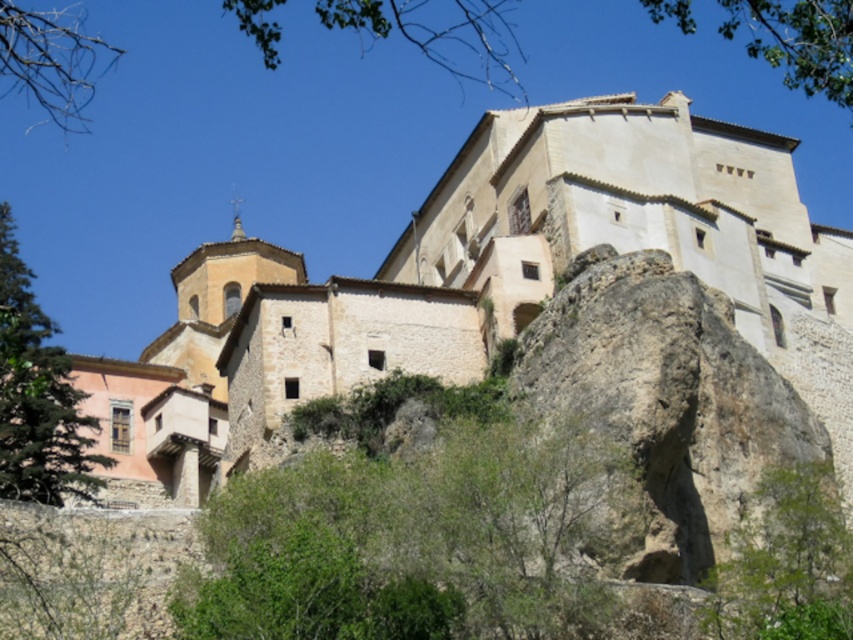
Who is shorter, green leafy tree at center or green leafy tree at lower right?

With less height is green leafy tree at lower right.

Does point (524, 451) lie behind point (827, 556)?

That is True.

Describe the element at coordinates (410, 541) in the screenshot. This screenshot has width=853, height=640. I see `green leafy tree at center` at that location.

This screenshot has width=853, height=640. In order to click on green leafy tree at center in this screenshot , I will do `click(410, 541)`.

Measure the distance between point (729, 604) and camera.

Point (729, 604) is 59.37 meters away from camera.

Which is below, green leafy tree at lower right or green leafy tree at lower left?

green leafy tree at lower right

Who is more forward, (837, 636) or (48, 422)?

Point (837, 636) is more forward.

Where is `green leafy tree at lower right`? The image size is (853, 640). green leafy tree at lower right is located at coordinates (786, 561).

Who is positioned more to the left, green leafy tree at center or green leafy tree at lower left?

green leafy tree at lower left is more to the left.

Is green leafy tree at center positioned in front of green leafy tree at lower left?

Yes, it is.

Which is behind, point (405, 518) or point (6, 332)?

The point (405, 518) is more distant.

Find the location of a particular element. Image resolution: width=853 pixels, height=640 pixels. green leafy tree at center is located at coordinates (410, 541).